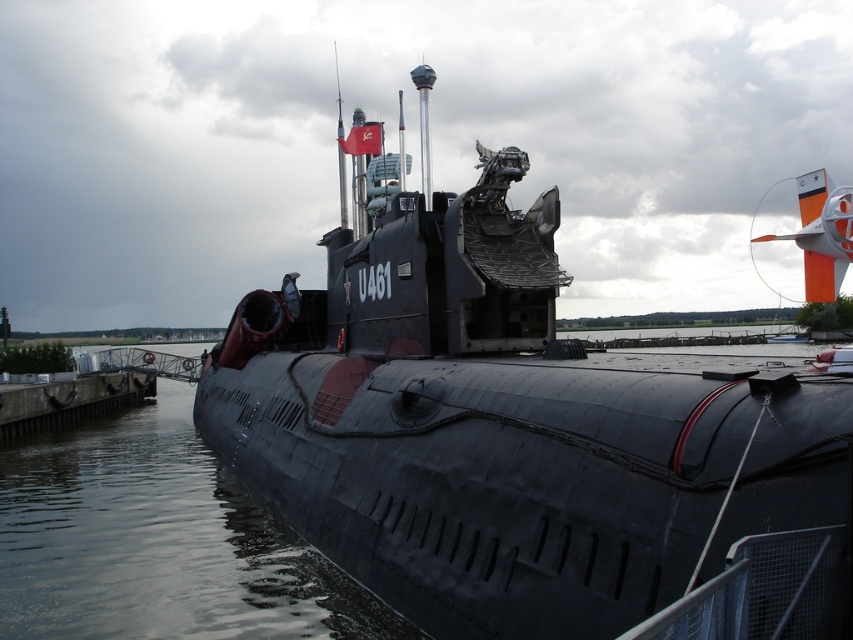
You are standing at the viewing platform near the submarine U461. You want to take a photo of the submarine but need to ensure you are close enough. The recommended distance for a clear photo is 10 meters. Is your current position at point (202, 605) within the recommended distance?

The distance between point (202, 605) and the camera is 11.30 meters. Since the recommended distance is 10 meters, you are slightly beyond the optimal range for a clear photo.

You are a tour guide explaining the layout of the submarine exhibit. Pointing to the matte black submarine at center and the smooth concrete dock at lower left, you want to describe their positions relative to each other. Which object is positioned to the right side?

The matte black submarine at center is to the right of the smooth concrete dock at lower left.